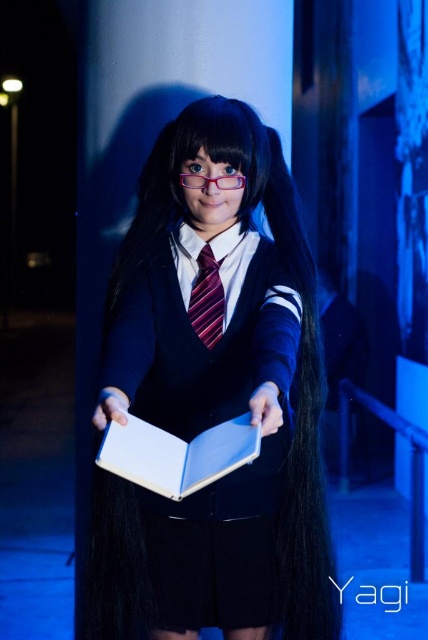
Question: Considering the relative positions of matte black uniform at center and striped silk tie at center in the image provided, where is matte black uniform at center located with respect to striped silk tie at center?

Choices:
 (A) left
 (B) right

Answer: (B)

Question: Can you confirm if white matte book at center is positioned above striped silk tie at center?

Choices:
 (A) yes
 (B) no

Answer: (B)

Question: Considering the real-world distances, which object is closest to the matte black uniform at center?

Choices:
 (A) striped silk tie at center
 (B) white matte book at center

Answer: (B)

Question: Which object appears closest to the camera in this image?

Choices:
 (A) striped silk tie at center
 (B) white matte book at center

Answer: (B)

Question: Is matte black uniform at center smaller than striped silk tie at center?

Choices:
 (A) no
 (B) yes

Answer: (A)

Question: Which object is farther from the camera taking this photo?

Choices:
 (A) matte black uniform at center
 (B) white matte book at center
 (C) striped silk tie at center

Answer: (C)